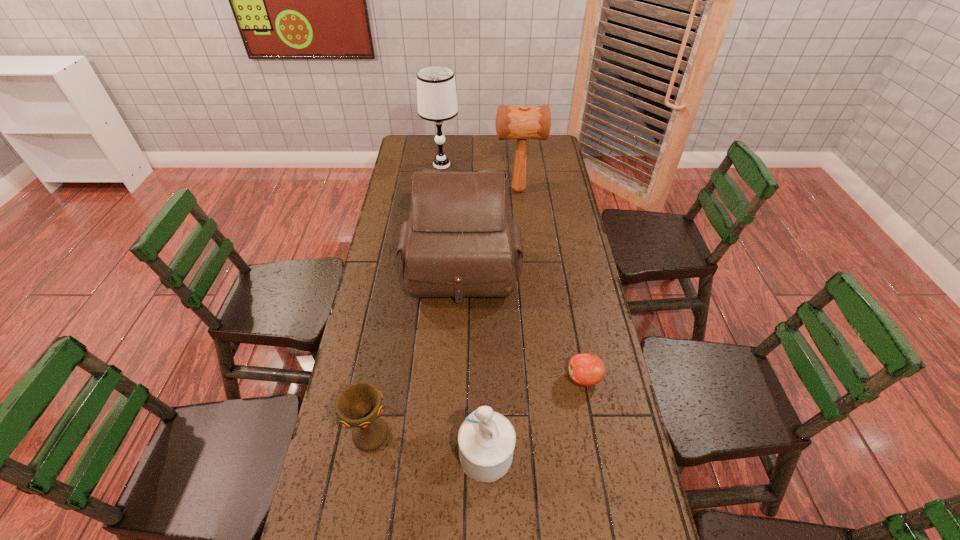
You are a GUI agent. You are given a task and a screenshot of the screen. Output one action in this format:
    pyautogui.click(x=<x>, y=<y>)
    Task: Click on the chalice that is at the left edge
    The height and width of the screenshot is (540, 960).
    Given the screenshot: What is the action you would take?
    pyautogui.click(x=359, y=405)

The image size is (960, 540). Identify the location of mallet positioned at the right edge. (526, 122).

Image resolution: width=960 pixels, height=540 pixels. I want to click on apple that is positioned at the right edge, so click(x=585, y=369).

Where is `object at the far left corner`? This screenshot has width=960, height=540. object at the far left corner is located at coordinates (436, 91).

The image size is (960, 540). What are the coordinates of `vacant area at the left edge` in the screenshot? It's located at (380, 297).

You are a GUI agent. You are given a task and a screenshot of the screen. Output one action in this format:
    pyautogui.click(x=<x>, y=<y>)
    Task: Click on the vacant space at the right edge of the desktop
    
    Given the screenshot: What is the action you would take?
    pyautogui.click(x=576, y=288)

In the image, there is a desktop. Identify the location of free space at the far left corner. Image resolution: width=960 pixels, height=540 pixels. (407, 150).

In the image, there is a desktop. Where is `free space at the far right corner`? Image resolution: width=960 pixels, height=540 pixels. free space at the far right corner is located at coordinates (559, 156).

Locate an element on the screen. The width and height of the screenshot is (960, 540). vacant point located between the table lamp and the third shortest object is located at coordinates (464, 310).

At what (x,y) coordinates should I click in order to perform the action: click on unoccupied position between the apple and the mallet. Please return your answer as a coordinate pair (x, y). Looking at the image, I should click on (551, 284).